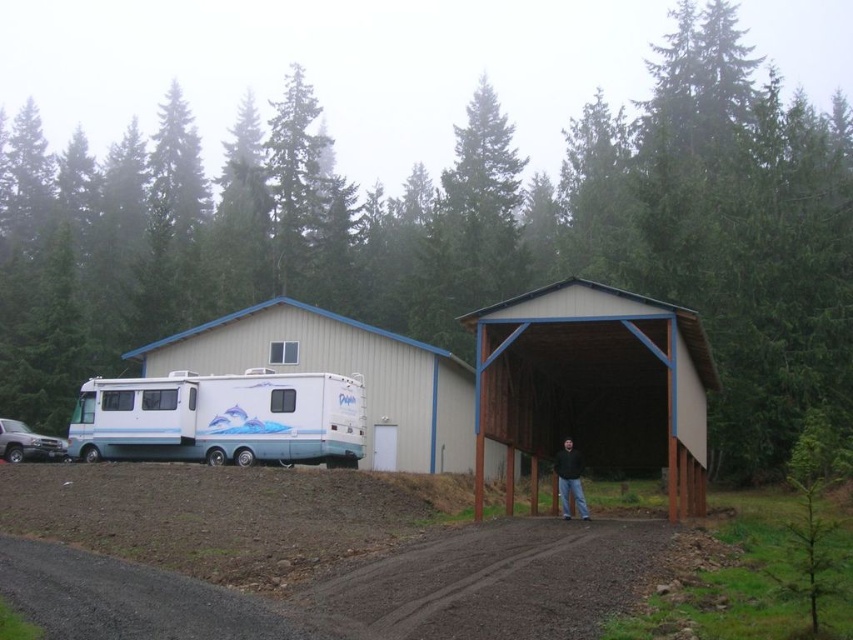
Can you confirm if brown gravel dirt track at center is taller than white glossy recreational vehicle at left?

No, brown gravel dirt track at center is not taller than white glossy recreational vehicle at left.

Between point (445, 634) and point (274, 394), which one is positioned behind?

The point (274, 394) is more distant.

What do you see at coordinates (496, 580) in the screenshot? I see `brown gravel dirt track at center` at bounding box center [496, 580].

The width and height of the screenshot is (853, 640). Find the location of `brown gravel dirt track at center`. brown gravel dirt track at center is located at coordinates (496, 580).

Can you confirm if brown wooden shed at center is bigger than white glossy rv at center?

No, brown wooden shed at center is not bigger than white glossy rv at center.

Who is more forward, (682,339) or (349,326)?

Point (682,339)

This screenshot has width=853, height=640. Identify the location of brown wooden shed at center. (595, 384).

Can you confirm if brown gravel dirt track at center is positioned to the right of white glossy rv at center?

Yes, brown gravel dirt track at center is to the right of white glossy rv at center.

Between point (581, 541) and point (338, 349), which one is positioned behind?

The point (338, 349) is behind.

You are a GUI agent. You are given a task and a screenshot of the screen. Output one action in this format:
    pyautogui.click(x=<x>, y=<y>)
    Task: Click on the brown gravel dirt track at center
    This screenshot has width=853, height=640.
    Given the screenshot: What is the action you would take?
    coord(496,580)